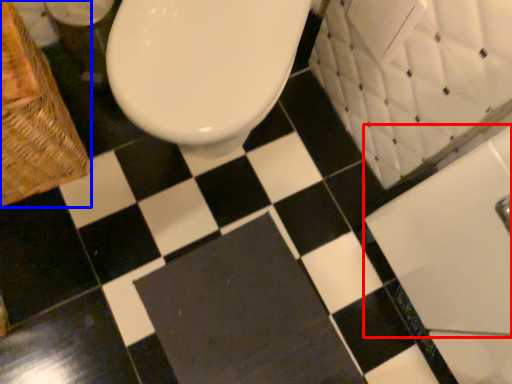
Question: Which of the following is the farthest to the observer, bath (highlighted by a red box) or basket (highlighted by a blue box)?

Choices:
 (A) bath
 (B) basket

Answer: (B)